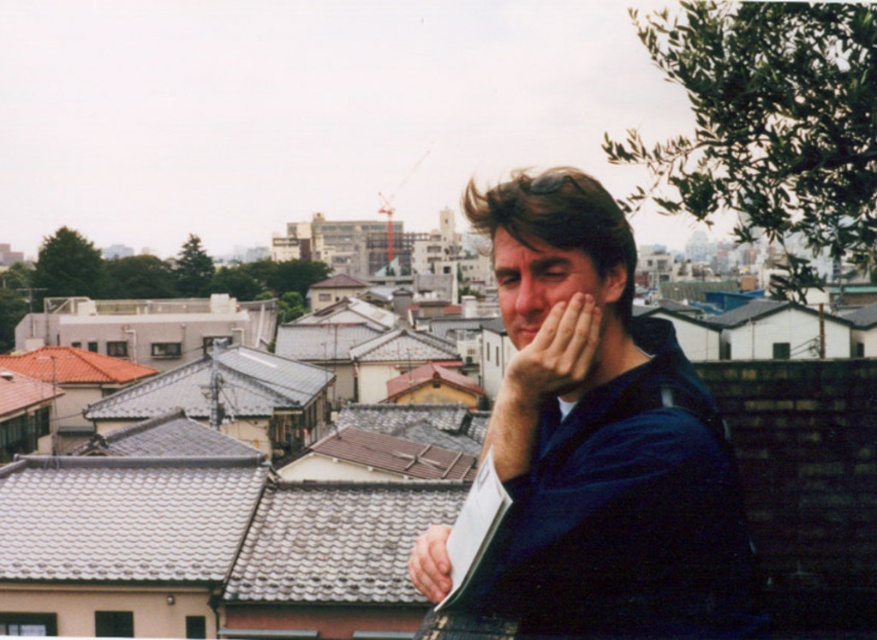
Question: Can you confirm if dark blue shirt at center is wider than smooth skin hand at center?

Choices:
 (A) no
 (B) yes

Answer: (B)

Question: Is smooth skin face at center positioned at the back of smooth skin hand at center?

Choices:
 (A) no
 (B) yes

Answer: (A)

Question: Can you confirm if dark blue shirt at center is positioned below smooth skin hand at center?

Choices:
 (A) yes
 (B) no

Answer: (B)

Question: Which point is farther to the camera?

Choices:
 (A) smooth skin face at center
 (B) matte skin hand at center
 (C) smooth skin hand at center
 (D) dark blue shirt at center

Answer: (C)

Question: Which of these objects is positioned closest to the smooth skin hand at center?

Choices:
 (A) matte skin hand at center
 (B) smooth skin face at center
 (C) dark blue shirt at center

Answer: (C)

Question: Among these objects, which one is farthest from the camera?

Choices:
 (A) matte skin hand at center
 (B) dark blue shirt at center
 (C) smooth skin face at center

Answer: (C)